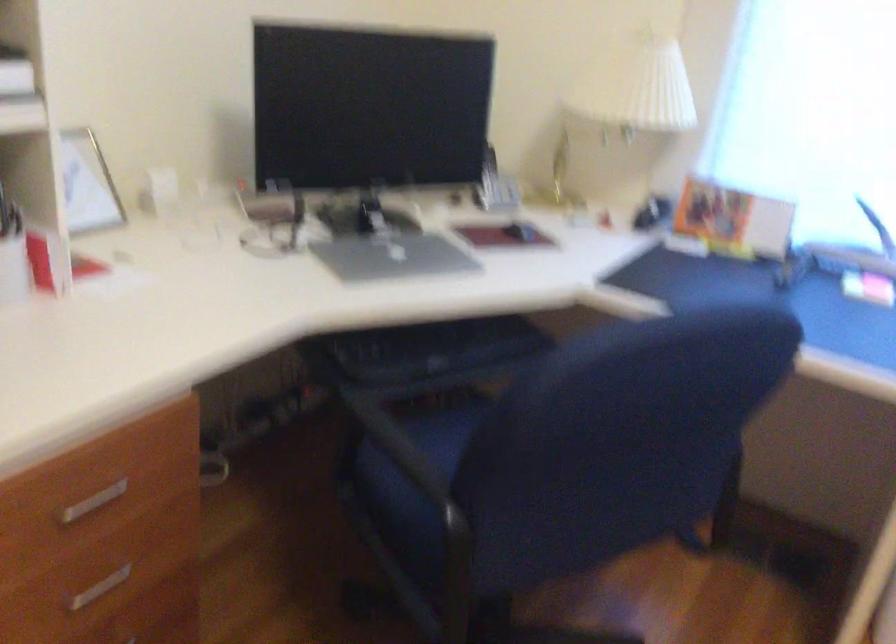
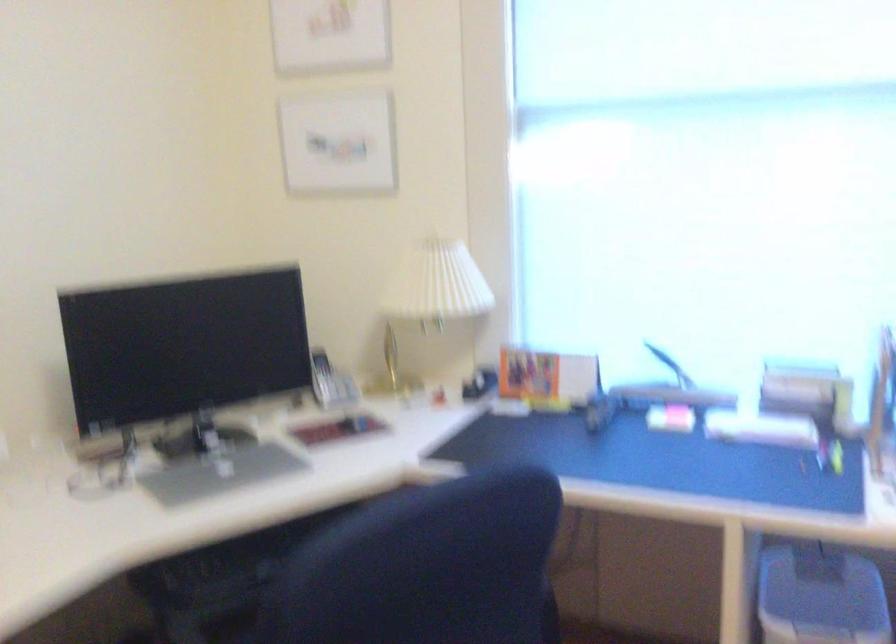
The point at (633, 104) is marked in the first image. Where is the corresponding point in the second image?

(433, 295)